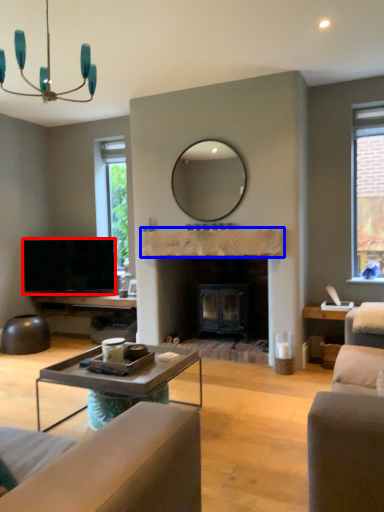
Question: Which point is further to the camera, television (highlighted by a red box) or mantle (highlighted by a blue box)?

Choices:
 (A) television
 (B) mantle

Answer: (A)